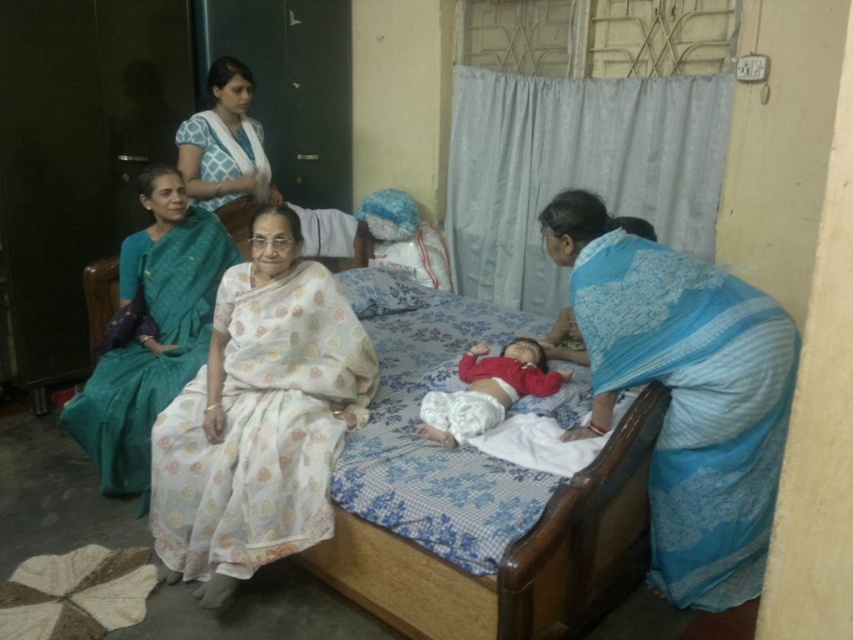
Question: Is blue floral saree at right positioned behind teal silk saree at left?

Choices:
 (A) yes
 (B) no

Answer: (B)

Question: Which object is farther from the camera taking this photo?

Choices:
 (A) blue floral saree at right
 (B) teal silk saree at left
 (C) white floral saree at center
 (D) white printed saree at upper center

Answer: (D)

Question: Which of the following is the farthest from the observer?

Choices:
 (A) pyautogui.click(x=96, y=465)
 (B) pyautogui.click(x=212, y=77)

Answer: (B)

Question: Which point is closer to the camera?

Choices:
 (A) white printed saree at upper center
 (B) teal silk saree at left
 (C) white floral saree at center

Answer: (C)

Question: Does white floral saree at center appear under teal silk saree at left?

Choices:
 (A) no
 (B) yes

Answer: (B)

Question: Is white printed saree at upper center thinner than red cotton baby at center?

Choices:
 (A) no
 (B) yes

Answer: (B)